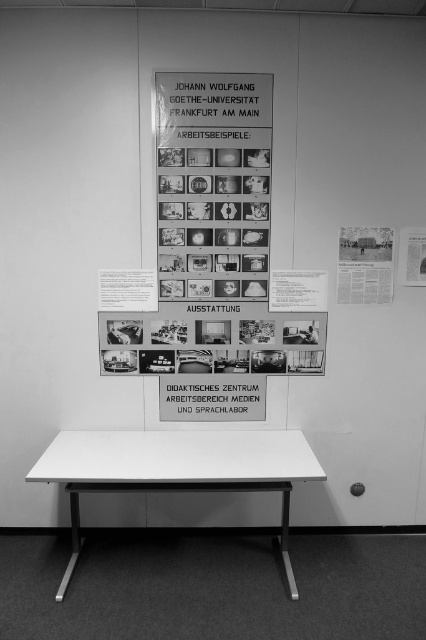
Is white matte table at center thinner than white paper at upper right?

Incorrect, white matte table at center's width is not less than white paper at upper right's.

Is point (265, 440) positioned in front of point (417, 241)?

Yes.

At what (x,y) coordinates should I click in order to perform the action: click on white matte table at center. Please return your answer as a coordinate pair (x, y). The height and width of the screenshot is (640, 426). Looking at the image, I should click on (176, 468).

The height and width of the screenshot is (640, 426). I want to click on white matte table at center, so click(x=176, y=468).

Is matte paper poster at upper right positioned at the back of white paper at upper right?

No, matte paper poster at upper right is in front of white paper at upper right.

Is point (357, 284) closer to viewer compared to point (402, 230)?

No, (357, 284) is further to viewer.

Who is more forward, (371, 253) or (403, 227)?

Point (403, 227)

Identify the location of matte paper poster at upper right. (365, 266).

Is white matte table at center to the right of matte paper poster at upper right from the viewer's perspective?

In fact, white matte table at center is to the left of matte paper poster at upper right.

Is point (135, 451) more distant than point (342, 243)?

No, it is in front of (342, 243).

Identify the location of white matte table at center. (176, 468).